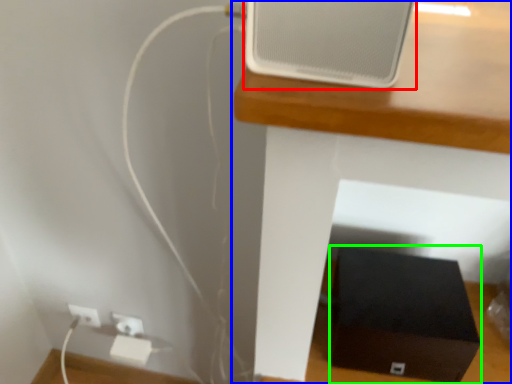
Question: Estimate the real-world distances between objects in this image. Which object is farther from ipod (highlighted by a red box), furniture (highlighted by a blue box) or box (highlighted by a green box)?

Choices:
 (A) furniture
 (B) box

Answer: (B)